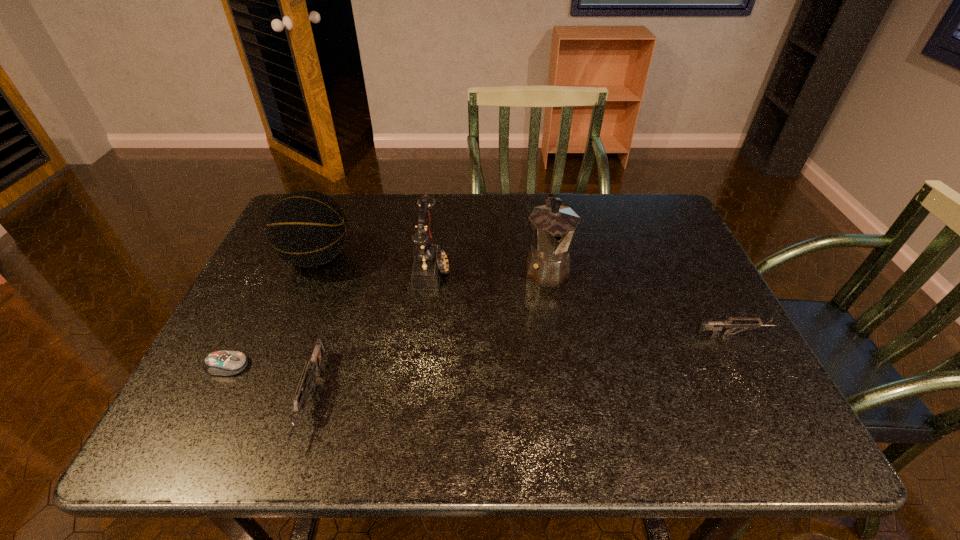
Find the location of a particular element. The image size is (960, 540). the taller gun is located at coordinates (313, 366).

In order to click on the nearer gun in this screenshot , I will do `click(313, 366)`.

You are a GUI agent. You are given a task and a screenshot of the screen. Output one action in this format:
    pyautogui.click(x=<x>, y=<y>)
    Task: Click on the shorter gun
    The image size is (960, 540).
    Given the screenshot: What is the action you would take?
    pyautogui.click(x=716, y=327)

The image size is (960, 540). What are the coordinates of `the fourth farthest object` in the screenshot? It's located at (716, 327).

The width and height of the screenshot is (960, 540). What are the coordinates of `basketball` in the screenshot? It's located at (305, 228).

The height and width of the screenshot is (540, 960). I want to click on the fifth object from left to right, so pos(552,226).

This screenshot has width=960, height=540. I want to click on the third object from right to left, so click(x=430, y=261).

Find the location of `computer mouse`. computer mouse is located at coordinates (221, 363).

Locate an element on the screen. This screenshot has height=540, width=960. free space located 0.060m on the right of the basketball is located at coordinates (375, 258).

This screenshot has height=540, width=960. I want to click on vacant space located on the pouring side of the second object from right to left, so click(x=561, y=353).